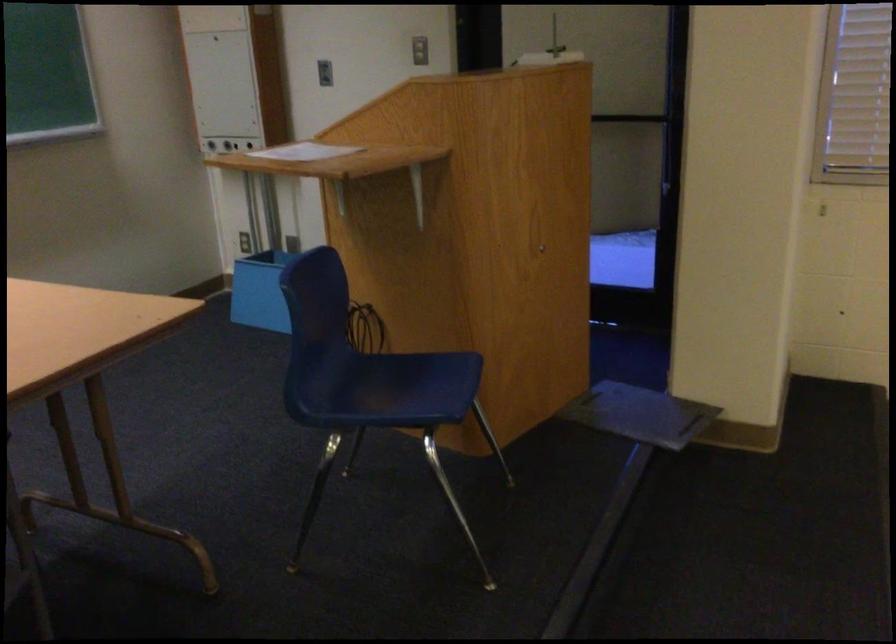
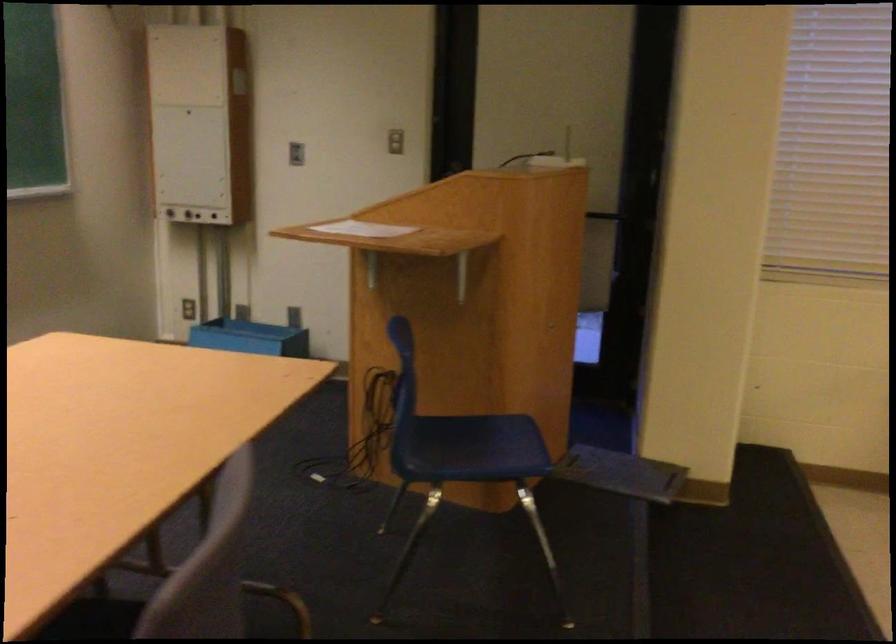
Question: The camera is either moving clockwise (left) or counter-clockwise (right) around the object. The first image is from the beginning of the video and the second image is from the end. Is the camera moving left or right when shooting the video?

Choices:
 (A) Left
 (B) Right

Answer: (A)